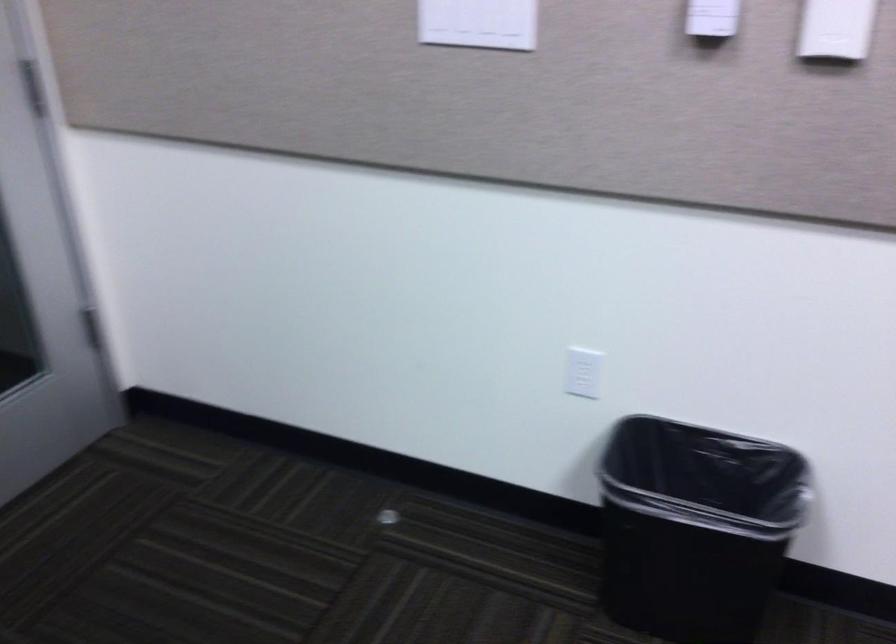
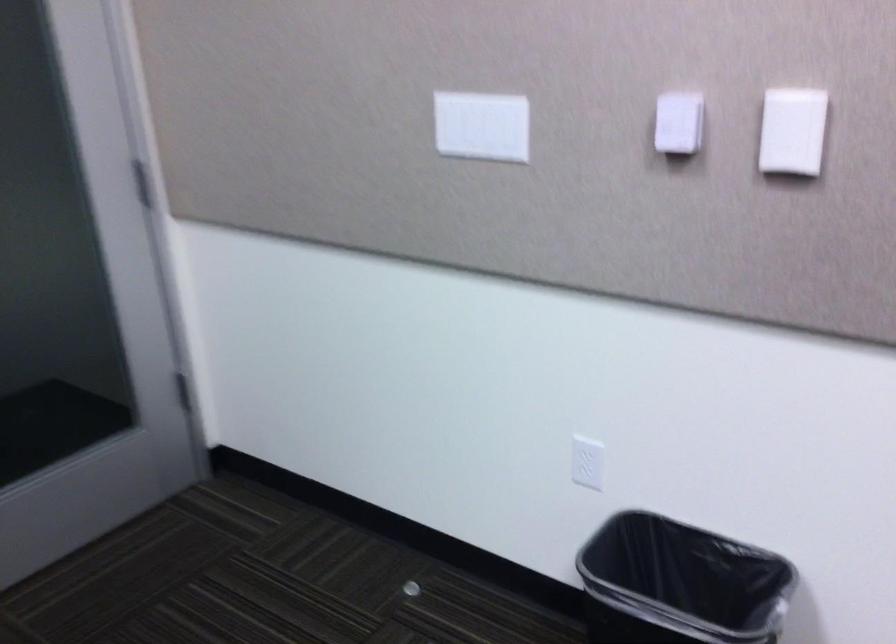
In the second image, find the point that corresponds to point 385,518 in the first image.

(410, 589)